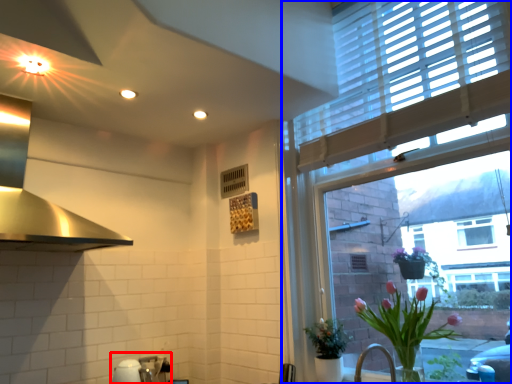
Question: Which point is further to the camera, sink (highlighted by a red box) or window (highlighted by a blue box)?

Choices:
 (A) sink
 (B) window

Answer: (A)